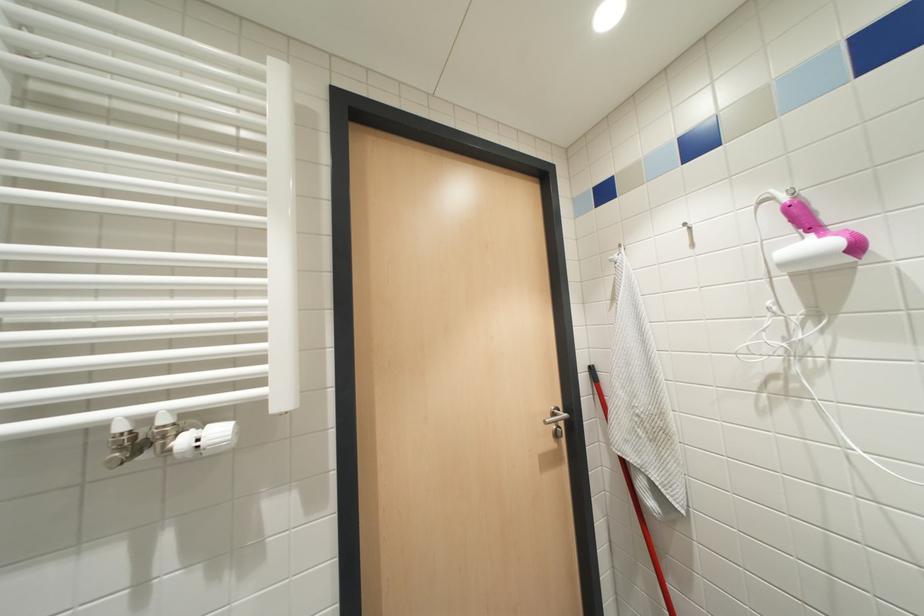
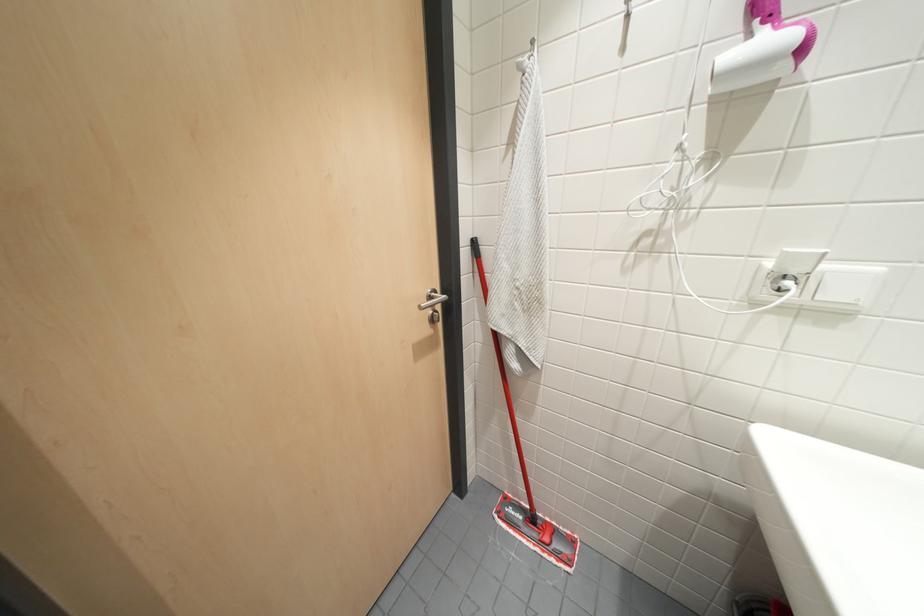
The images are taken continuously from a first-person perspective. In which direction is your viewpoint rotating?

The camera's rotation is toward right-down.